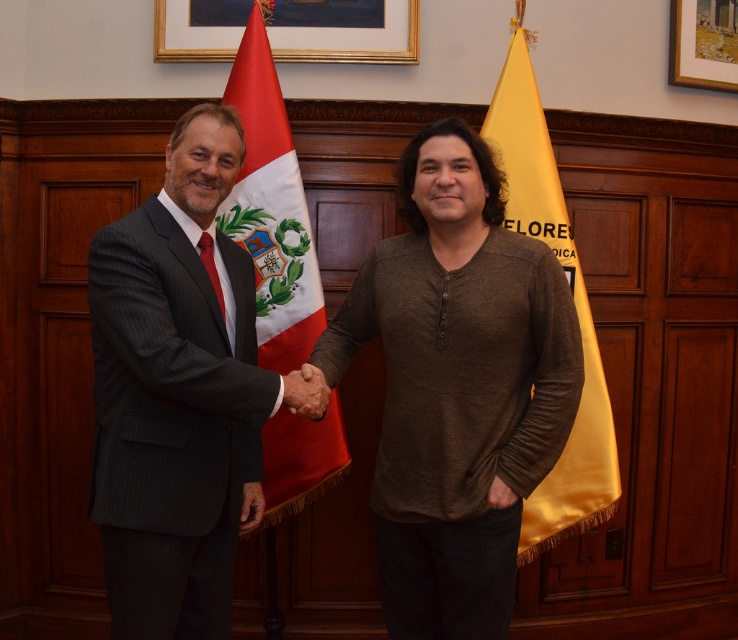
Looking at this image, you are an interior designer observing the scene. You need to hang a new painting that is the same height as the wooden picture frame at upper right on the wall between the brown cotton shirt at center and the flag on its right. Will the available space be sufficient?

The brown cotton shirt at center is much taller than the wooden picture frame at upper right. Since the new painting has the same height as the wooden picture frame at upper right, the available space between the brown cotton shirt at center and the flag on its right should be sufficient as the painting is shorter than the shirt.

You are standing at the entrance of the room and want to place a 6 feet long banner between the brown cotton shirt at center and the wooden picture frame at upper right. Will there be enough space?

The distance between the brown cotton shirt at center and the wooden picture frame at upper right is 5.36 feet, which is shorter than the 6 feet banner. Therefore, the banner will not fit between them.